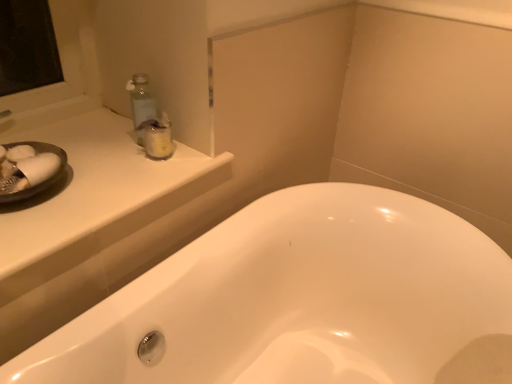
At what (x,y) coordinates should I click in order to perform the action: click on free point to the right of clear plastic jar at upper left. Please return your answer as a coordinate pair (x, y). The image size is (512, 384). Looking at the image, I should click on point(192,162).